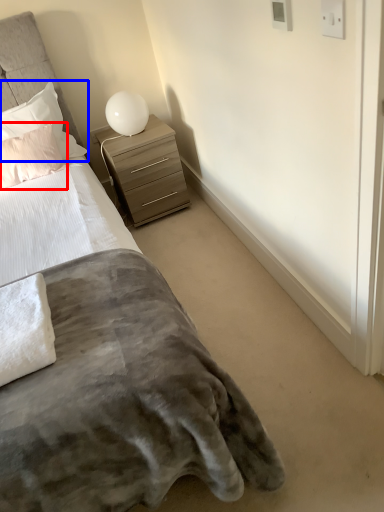
Question: Which of the following is the farthest to the observer, pillow (highlighted by a red box) or pillow (highlighted by a blue box)?

Choices:
 (A) pillow
 (B) pillow

Answer: (B)